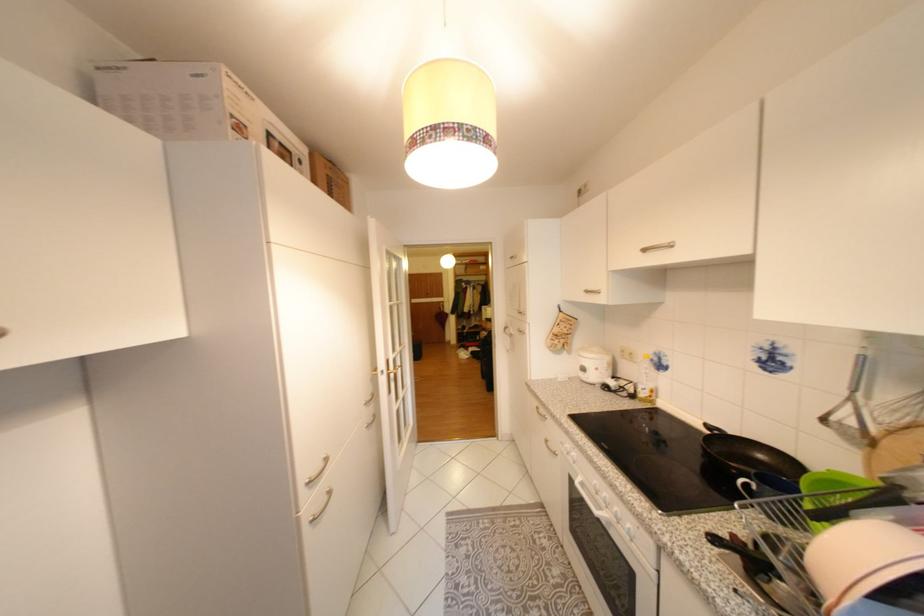
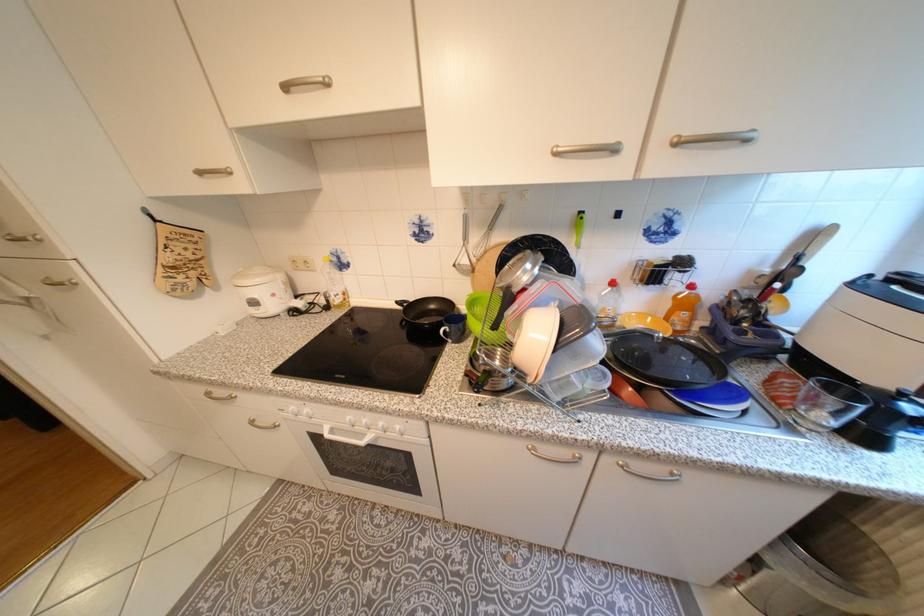
Where in the second image is the point corresponding to the point at 715,426 from the first image?

(407, 302)